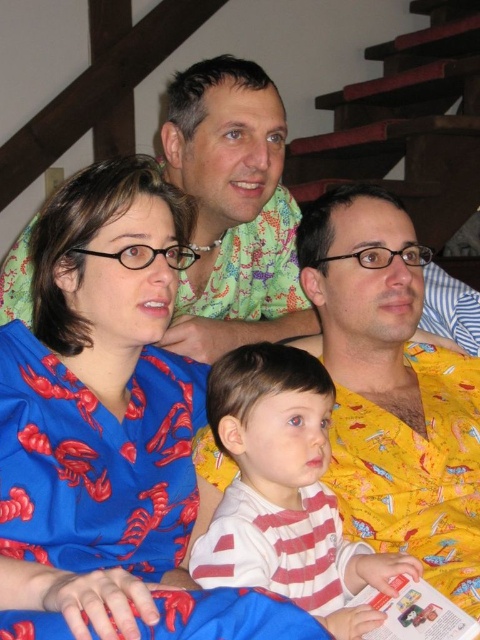
Question: Can you confirm if white striped shirt at center is thinner than matte paper magazine at lower right?

Choices:
 (A) no
 (B) yes

Answer: (A)

Question: Which of the following is the farthest from the observer?

Choices:
 (A) (116, 401)
 (B) (249, 563)
 (C) (184, 336)

Answer: (C)

Question: Which of the following is the farthest from the observer?

Choices:
 (A) (165, 438)
 (B) (398, 636)
 (C) (204, 115)

Answer: (C)

Question: Which object is the closest to the white striped shirt at center?

Choices:
 (A) green floral shirt at upper center
 (B) matte paper magazine at lower right

Answer: (B)

Question: Is blue satin blouse at center wider than green floral shirt at upper center?

Choices:
 (A) yes
 (B) no

Answer: (A)

Question: From the image, what is the correct spatial relationship of blue satin blouse at center in relation to white striped shirt at center?

Choices:
 (A) left
 (B) right

Answer: (A)